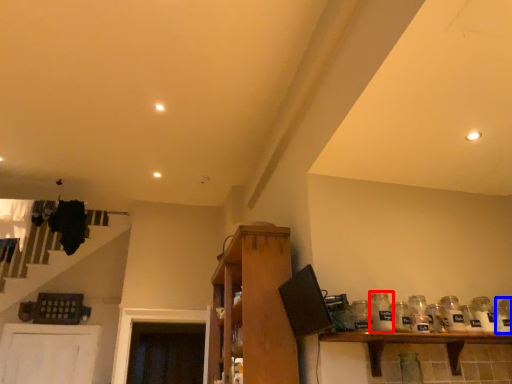
Question: Among these objects, which one is nearest to the camera, glass bottle (highlighted by a red box) or glass jar (highlighted by a blue box)?

Choices:
 (A) glass bottle
 (B) glass jar

Answer: (A)